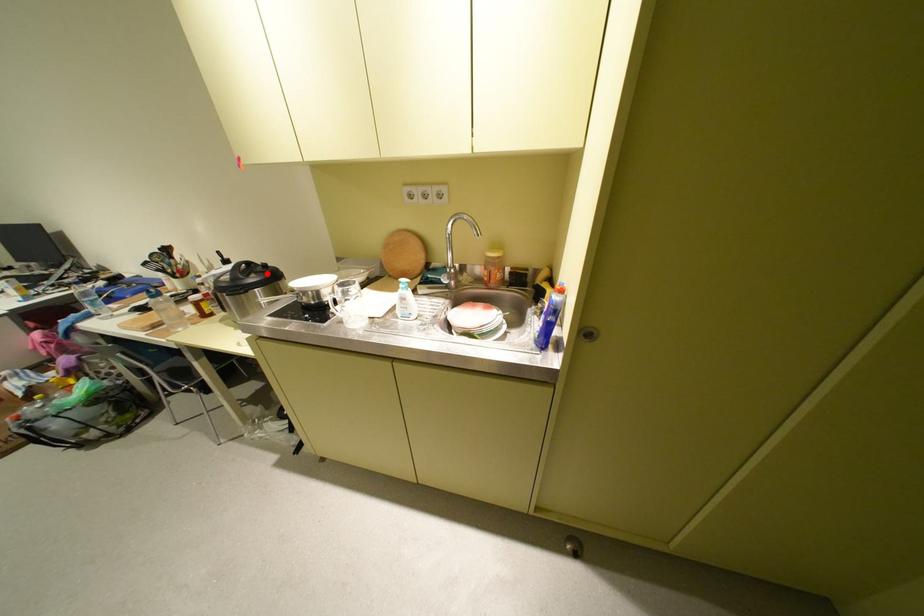
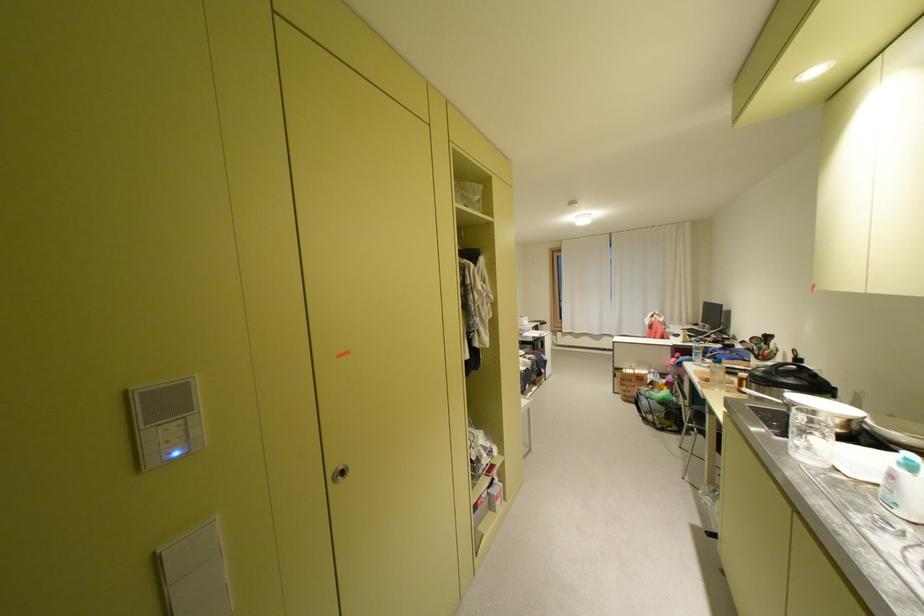
In the second image, find the point that corresponds to the highlighted location in the first image.

(808, 378)